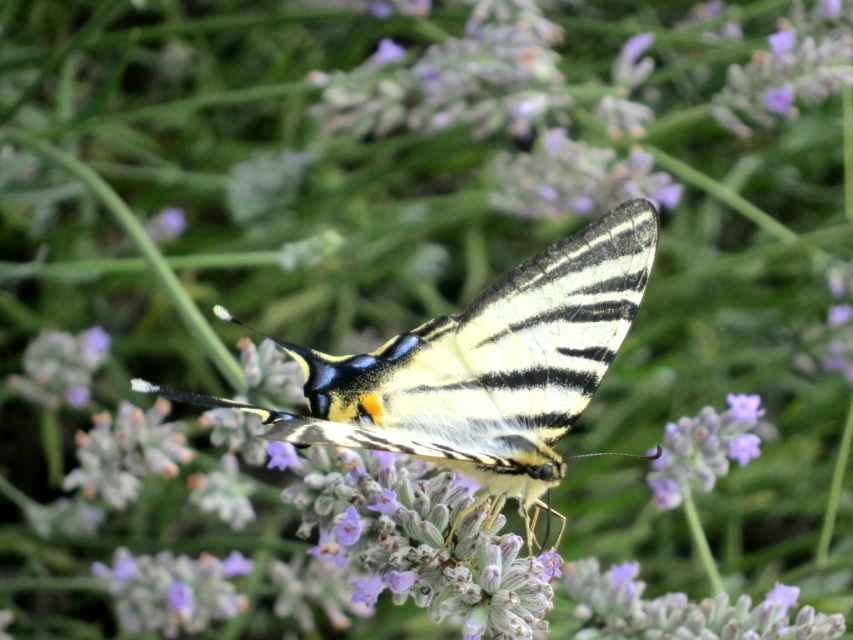
You are a photographer trying to capture the shiny yellow and black butterfly at center and the purple fuzzy lavender at center in a single shot. Based on their positions, which one will be in focus if you focus on the butterfly?

The shiny yellow and black butterfly at center will be in focus because it is in front of the purple fuzzy lavender at center. Since focusing on the butterfly, it will be sharp while the lavender behind it may be slightly blurred.

You are a photographer trying to capture the shiny yellow and black butterfly at center and the purple fuzzy lavender at center in a single frame. Based on their sizes, which object should you focus on to ensure both are clearly visible in your photo?

The shiny yellow and black butterfly at center is larger than the purple fuzzy lavender at center. To ensure both are clearly visible, focus on the butterfly since its larger size will allow for better detail retention while the lavender will still be in the frame.

You are an entomologist observing the butterfly and need to mark two specific points on its wings for a study. The first point is at coordinates point (474, 305), and the second point is at coordinates point (726, 413). Which of these two points is closer to the observer?

Point (474, 305) is in front of point (726, 413), so the first point is closer to the observer.